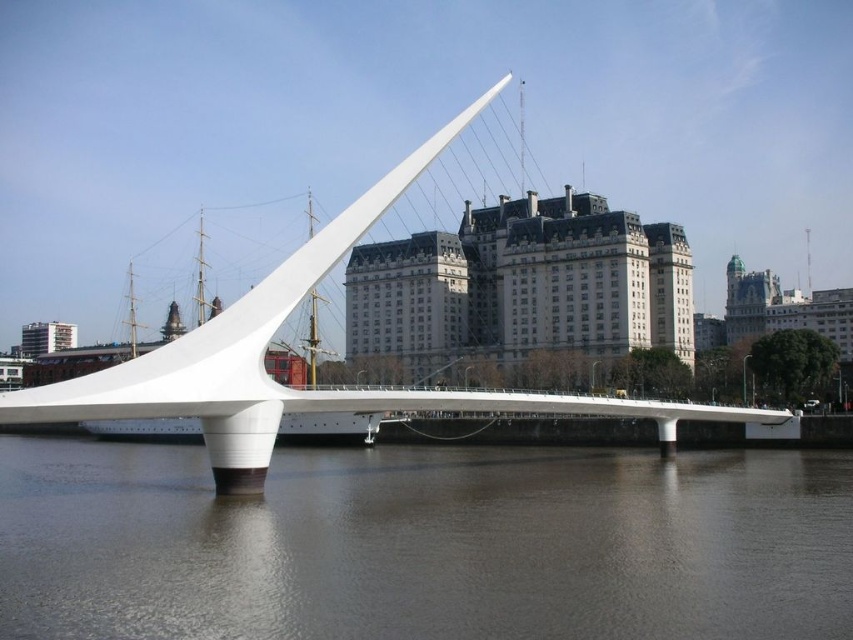
Is point (412, 557) more distant than point (277, 385)?

No, it is not.

Does brown reflective water at center come behind white smooth bridge at center?

No, brown reflective water at center is in front of white smooth bridge at center.

Does point (161, 472) come behind point (415, 177)?

Yes, point (161, 472) is behind point (415, 177).

I want to click on brown reflective water at center, so click(425, 545).